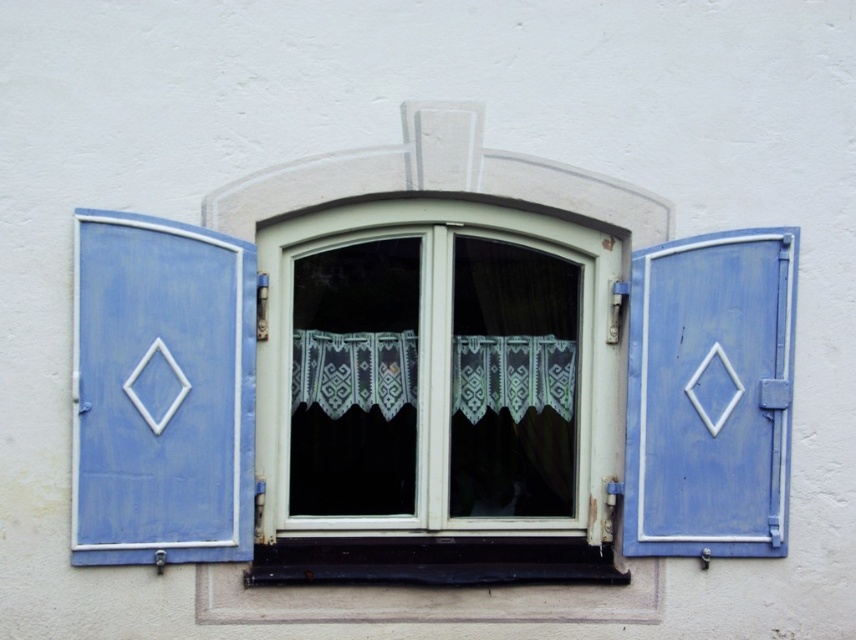
Can you confirm if matte blue wooden shutter at left is positioned above black painted wood at lower center?

Yes.

Between matte blue wooden shutter at left and black painted wood at lower center, which one appears on the right side from the viewer's perspective?

Positioned to the right is black painted wood at lower center.

At what (x,y) coordinates should I click in order to perform the action: click on matte blue wooden shutter at left. Please return your answer as a coordinate pair (x, y). The width and height of the screenshot is (856, 640). Looking at the image, I should click on (161, 392).

Looking at this image, who is lower down, blue matte shutter at right or black painted wood at lower center?

black painted wood at lower center is lower down.

Based on the photo, is the position of blue matte shutter at right less distant than that of black painted wood at lower center?

No.

What do you see at coordinates (709, 396) in the screenshot? I see `blue matte shutter at right` at bounding box center [709, 396].

You are a GUI agent. You are given a task and a screenshot of the screen. Output one action in this format:
    pyautogui.click(x=<x>, y=<y>)
    Task: Click on the blue matte shutter at right
    
    Given the screenshot: What is the action you would take?
    [709, 396]

Does matte blue wooden shutter at left appear over blue matte shutter at right?

Yes, matte blue wooden shutter at left is above blue matte shutter at right.

Who is shorter, matte blue wooden shutter at left or blue matte shutter at right?

blue matte shutter at right is shorter.

Does point (119, 342) come in front of point (758, 392)?

That is True.

You are a GUI agent. You are given a task and a screenshot of the screen. Output one action in this format:
    pyautogui.click(x=<x>, y=<y>)
    Task: Click on the matte blue wooden shutter at left
    The image size is (856, 640).
    Given the screenshot: What is the action you would take?
    pyautogui.click(x=161, y=392)